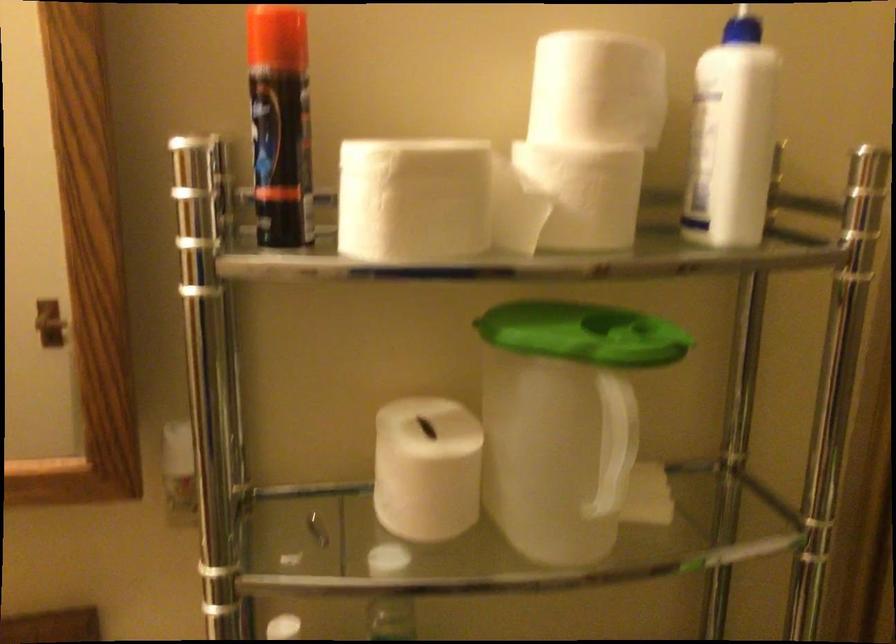
Where would you press the white bottle pump? Please return your answer as a coordinate pair (x, y).

(742, 28)